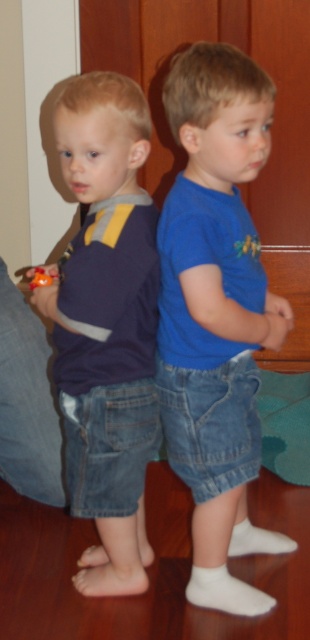
What do you see at coordinates (217, 312) in the screenshot? This screenshot has width=310, height=640. I see `blue denim shorts at center` at bounding box center [217, 312].

Based on the photo, is blue denim shorts at center thinner than orange matte toy at lower left?

No, blue denim shorts at center is not thinner than orange matte toy at lower left.

Is point (220, 554) in front of point (39, 275)?

No, it is behind (39, 275).

Identify the location of blue denim shorts at center. This screenshot has height=640, width=310. (217, 312).

Who is taller, blue denim shorts at center or matte blue shirt at left?

Standing taller between the two is blue denim shorts at center.

Consider the image. Which of these two, blue denim shorts at center or matte blue shirt at left, stands shorter?

matte blue shirt at left

Where is `blue denim shorts at center`? blue denim shorts at center is located at coordinates [217, 312].

Find the location of a particular element. This screenshot has height=640, width=310. blue denim shorts at center is located at coordinates (217, 312).

Does point (70, 436) come closer to viewer compared to point (45, 275)?

No, (70, 436) is behind (45, 275).

Can you confirm if matte blue shirt at left is positioned to the right of orange matte toy at lower left?

Correct, you'll find matte blue shirt at left to the right of orange matte toy at lower left.

Between point (122, 429) and point (44, 272), which one is positioned in front?

Point (122, 429) is in front.

At what (x,y) coordinates should I click in order to perform the action: click on matte blue shirt at left. Please return your answer as a coordinate pair (x, y). The width and height of the screenshot is (310, 640). Looking at the image, I should click on (106, 323).